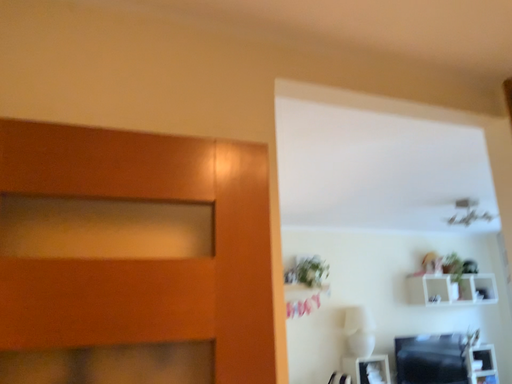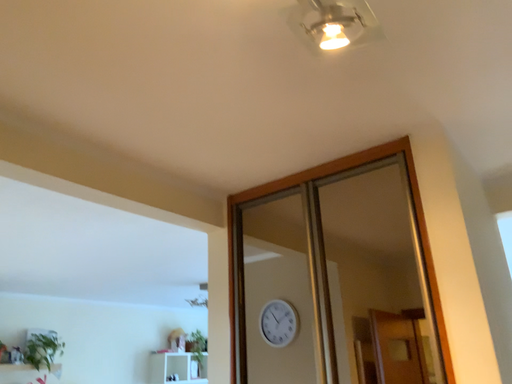
Question: Which way did the camera rotate in the video?

Choices:
 (A) rotated left
 (B) rotated right

Answer: (B)